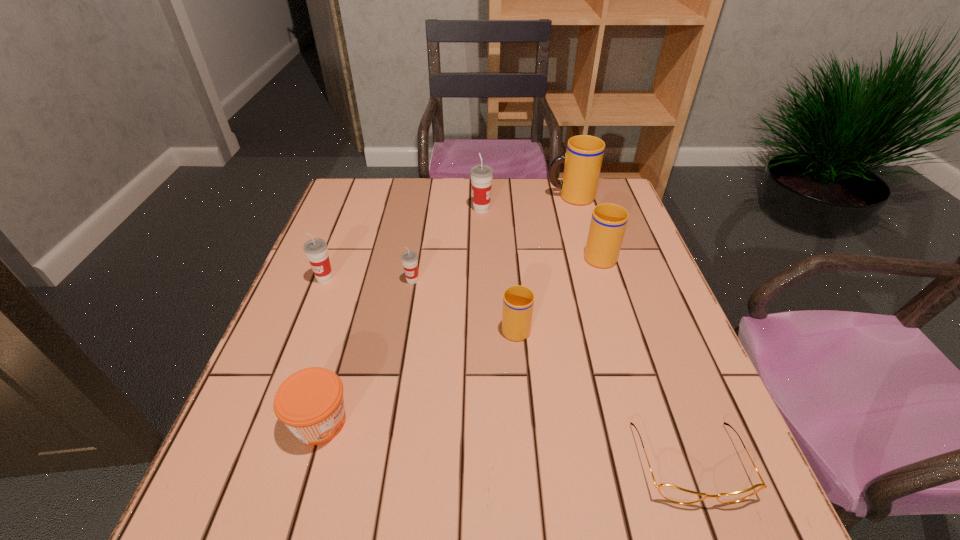
In the image, there is a desktop. Identify the location of vacant space at the near right corner. (728, 533).

Locate an element on the screen. Image resolution: width=960 pixels, height=540 pixels. free space that is in between the second smallest beige cup and the biggest beige cup is located at coordinates (585, 225).

I want to click on vacant area that lies between the sixth nearest object and the second red cup from right to left, so click(506, 267).

Where is `unoccupied area between the farthest red cup and the fourth object from right to left`? The width and height of the screenshot is (960, 540). unoccupied area between the farthest red cup and the fourth object from right to left is located at coordinates (498, 268).

Find the location of a particular element. Image resolution: width=960 pixels, height=540 pixels. vacant area that lies between the seventh object from right to left and the nearest cup is located at coordinates (418, 374).

The image size is (960, 540). I want to click on free point between the second red cup from right to left and the biggest beige cup, so click(x=492, y=239).

Find the location of a particular element. The width and height of the screenshot is (960, 540). vacant space that's between the second red cup from right to left and the fourth cup from right to left is located at coordinates coord(447,245).

This screenshot has width=960, height=540. Identify the location of free space between the smallest beige cup and the shortest object. (603, 394).

What are the coordinates of `vacant area that lies between the gold spectacles and the third farthest object` in the screenshot? It's located at (644, 359).

Find the location of a particular element. The height and width of the screenshot is (540, 960). free space that is in between the seventh object from right to left and the third farthest cup is located at coordinates (460, 338).